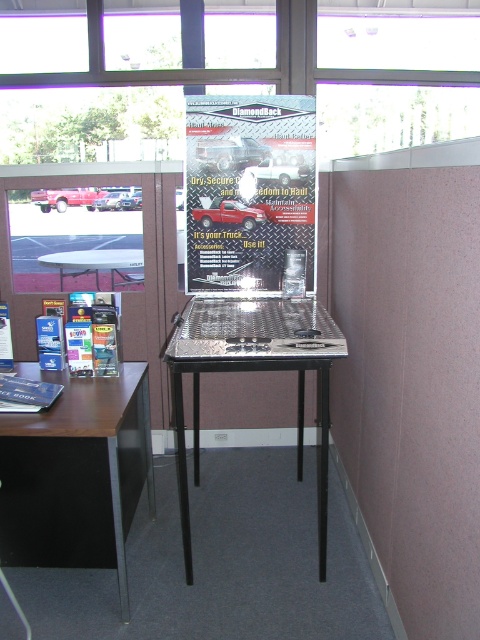
You are standing at point (305, 355) in the trade show booth. You want to move to the entrance located at point (191, 289). Is the entrance directly in front of you or behind you?

Point (191, 289) is behind point (305, 355), so the entrance located at point (191, 289) is behind you.

You are setting up for an event and need to place a 1.5m tall banner stand. Given the space between the matte black table at left and the transparent glass window at upper center, will the banner stand fit vertically without touching either object?

The matte black table at left is not as tall as the transparent glass window at upper center. Since the banner stand is 1.5m tall, it may fit vertically between them, but the exact height of the window and table must be considered to ensure clearance.